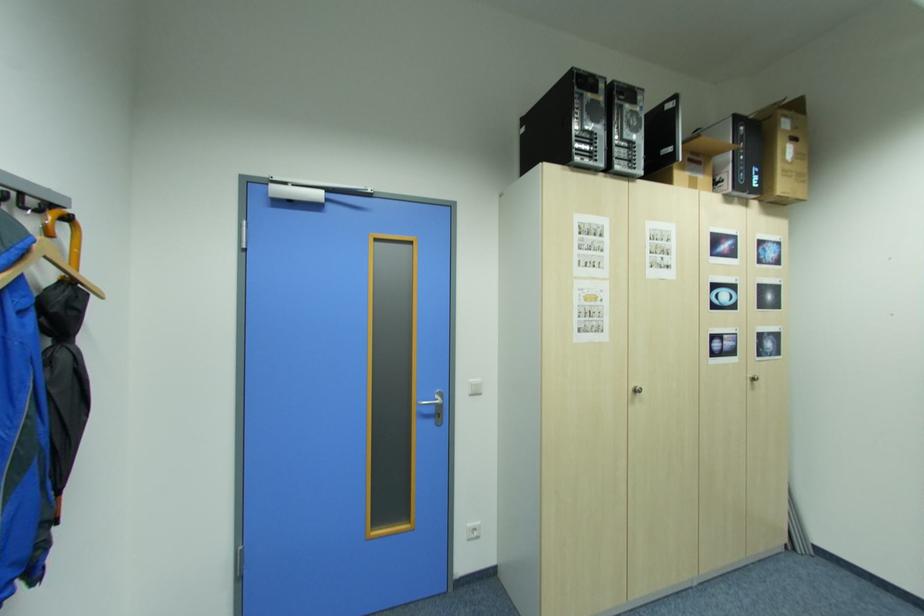
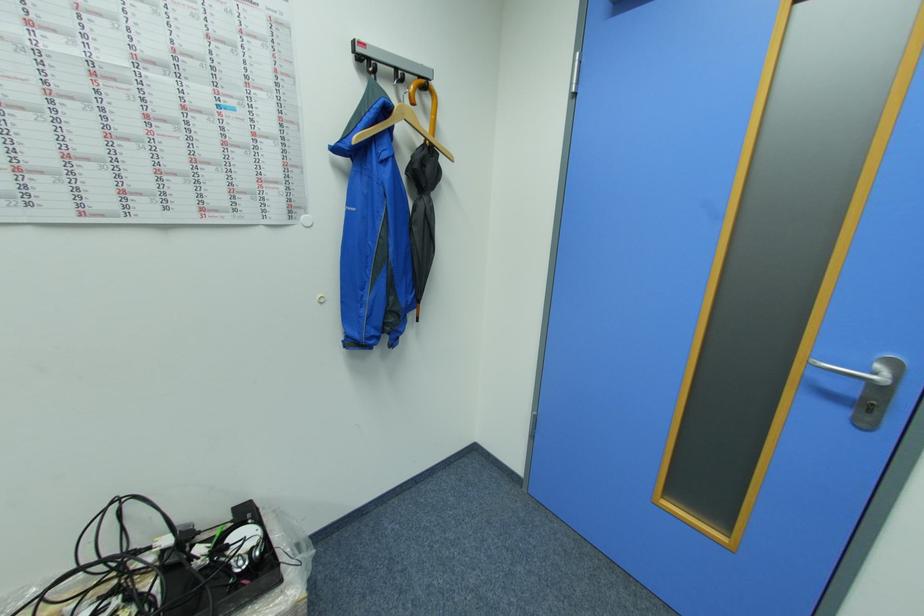
How did the camera likely rotate?

The rotation direction of the camera is left-down.